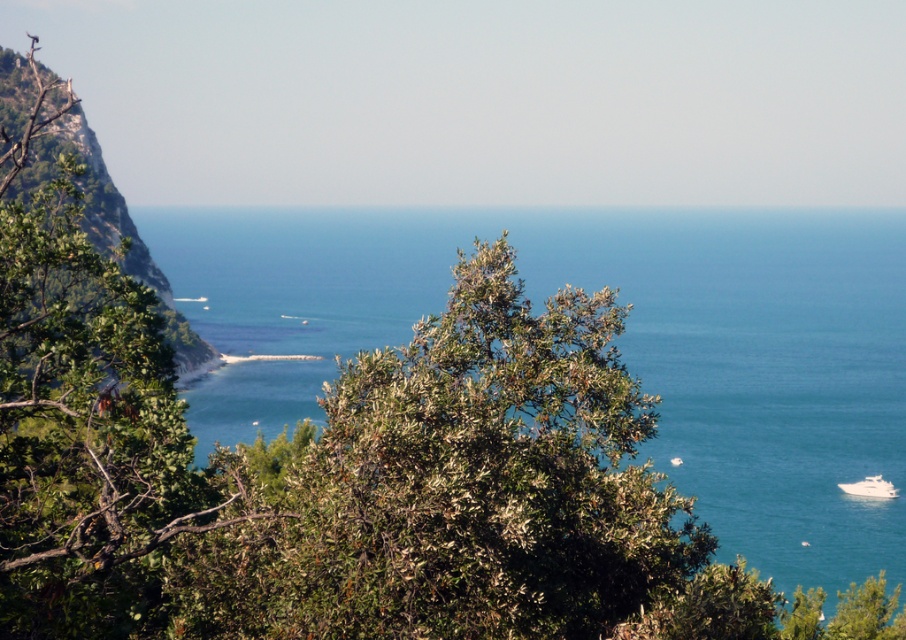
In the scene shown: You are standing at the edge of the coastal landscape and want to cross to the other side. The blue water at center and the green leafy hillside at left are both potential paths. Based on their widths, which path would allow you to walk without needing to narrow your path?

The blue water at center has a greater width than the green leafy hillside at left, so you can walk across the blue water at center without needing to narrow your path since it is wider.

You are standing at the shore looking out at the scene. Which object, the blue water at center or the green leafy hillside at left, is positioned higher in the image?

The blue water at center is positioned higher than the green leafy hillside at left in the image.